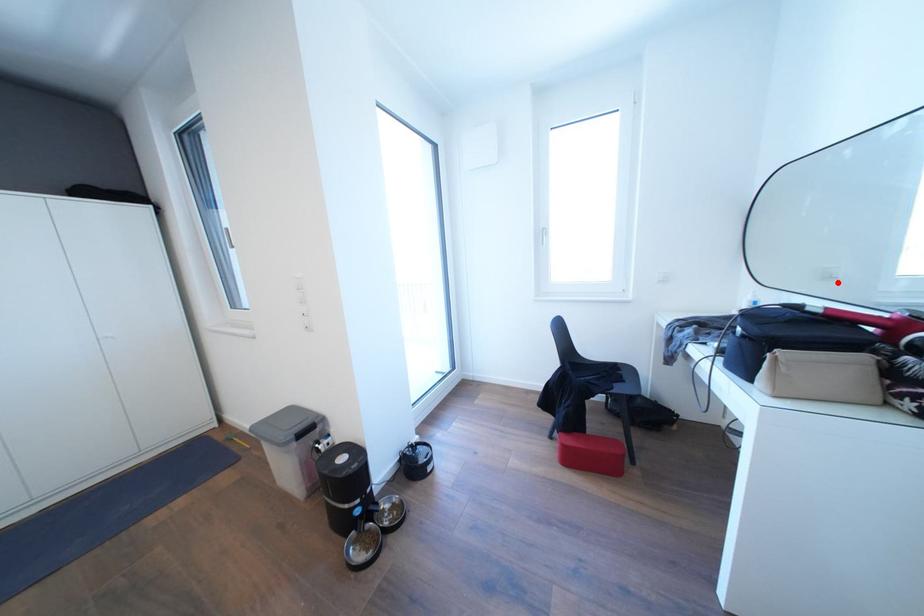
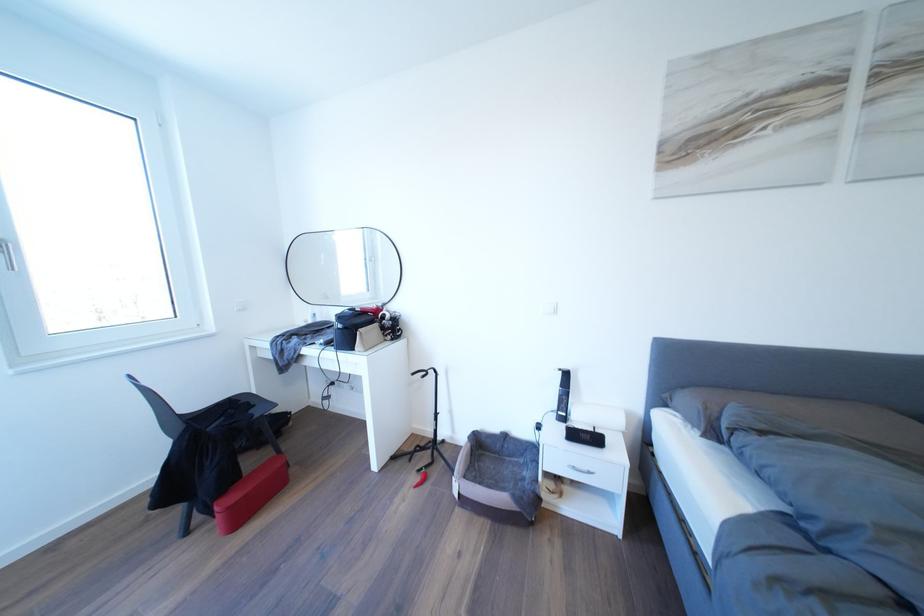
The point at the highlighted location is marked in the first image. Where is the corresponding point in the second image?

(334, 302)